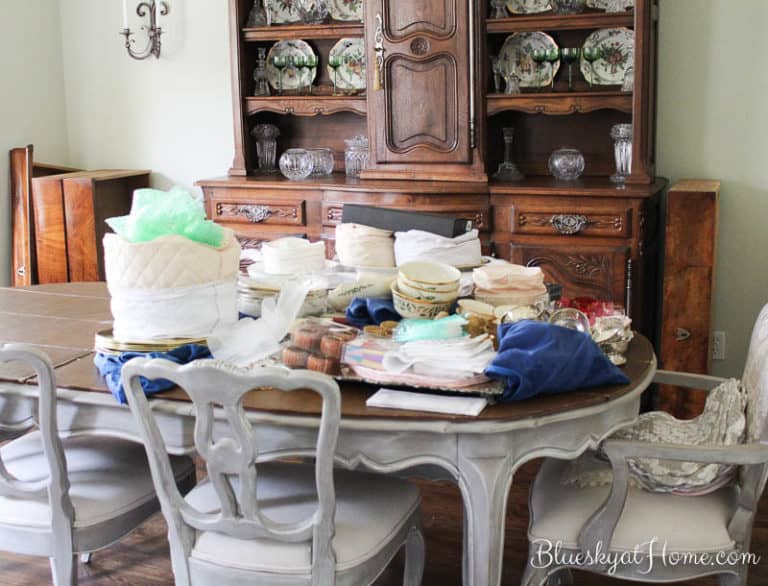
Find the location of a particular element. This screenshot has height=586, width=768. chairs is located at coordinates (51, 534), (325, 575), (679, 567).